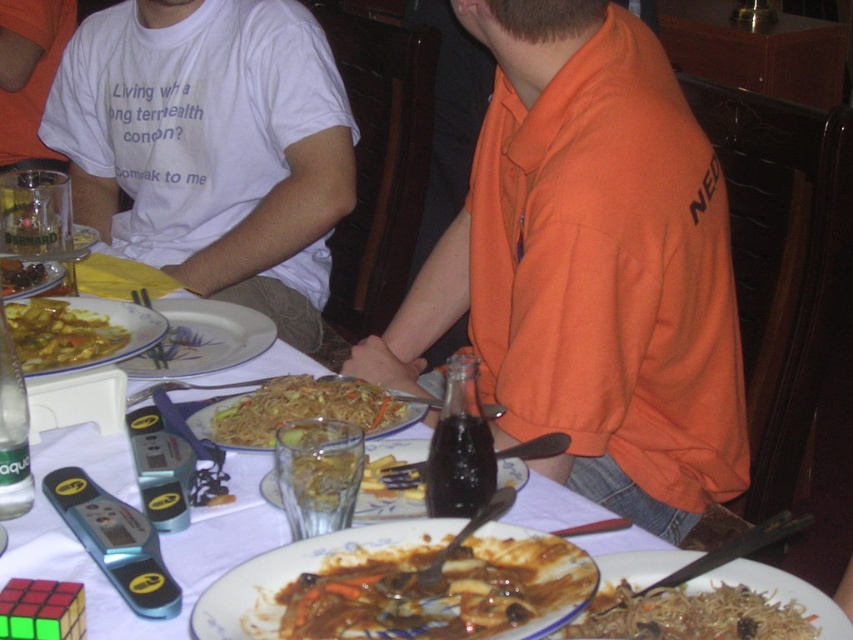
Question: Which point appears farthest from the camera in this image?

Choices:
 (A) (782, 611)
 (B) (361, 412)

Answer: (B)

Question: Which object is positioned closest to the dark glossy seeds at upper left?

Choices:
 (A) orange cotton shirt at center
 (B) yellowish glossy noodles at center

Answer: (B)

Question: Which point appears farthest from the camera in this image?

Choices:
 (A) (352, 401)
 (B) (664, 102)
 (C) (84, 563)

Answer: (B)

Question: Can you confirm if white cotton shirt at upper left is smaller than translucent glass plate at center?

Choices:
 (A) yes
 (B) no

Answer: (B)

Question: Does orange cotton shirt at center have a lesser width compared to yellowish matte noodles at center?

Choices:
 (A) no
 (B) yes

Answer: (A)

Question: Observing the image, what is the correct spatial positioning of brown glossy meat at center in reference to yellowish glossy noodles at center?

Choices:
 (A) left
 (B) right

Answer: (B)